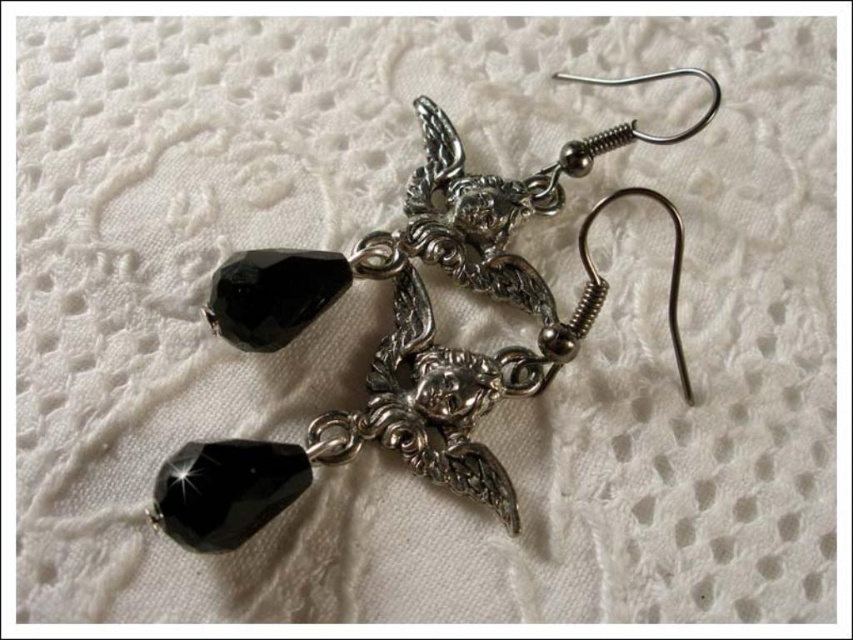
Which is more to the right, silver metallic hook at center or black faceted glass bead at lower left?

From the viewer's perspective, silver metallic hook at center appears more on the right side.

Consider the image. Can you confirm if silver metallic hook at center is positioned above black faceted glass bead at lower left?

Yes.

Describe the element at coordinates (405, 333) in the screenshot. I see `silver metallic hook at center` at that location.

What are the coordinates of `silver metallic hook at center` in the screenshot? It's located at (405, 333).